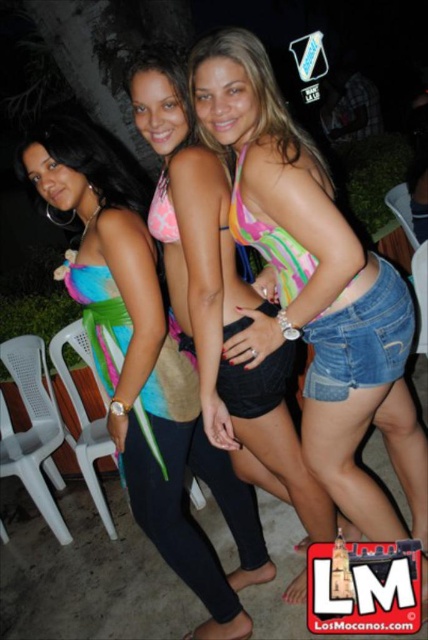
Question: Is multicolored fabric bikini top at center above multicolored bikini top at center?

Choices:
 (A) no
 (B) yes

Answer: (B)

Question: Which point appears closest to the camera in this image?

Choices:
 (A) (168, 385)
 (B) (321, 301)

Answer: (B)

Question: Which object is farther from the camera taking this photo?

Choices:
 (A) multicolored bikini top at center
 (B) multicolored fabric bikini top at center

Answer: (A)

Question: Can you confirm if multicolored fabric bikini top at center is wider than multicolored bikini top at center?

Choices:
 (A) yes
 (B) no

Answer: (A)

Question: Does multicolored fabric bikini top at center appear under multicolored bikini top at center?

Choices:
 (A) no
 (B) yes

Answer: (A)